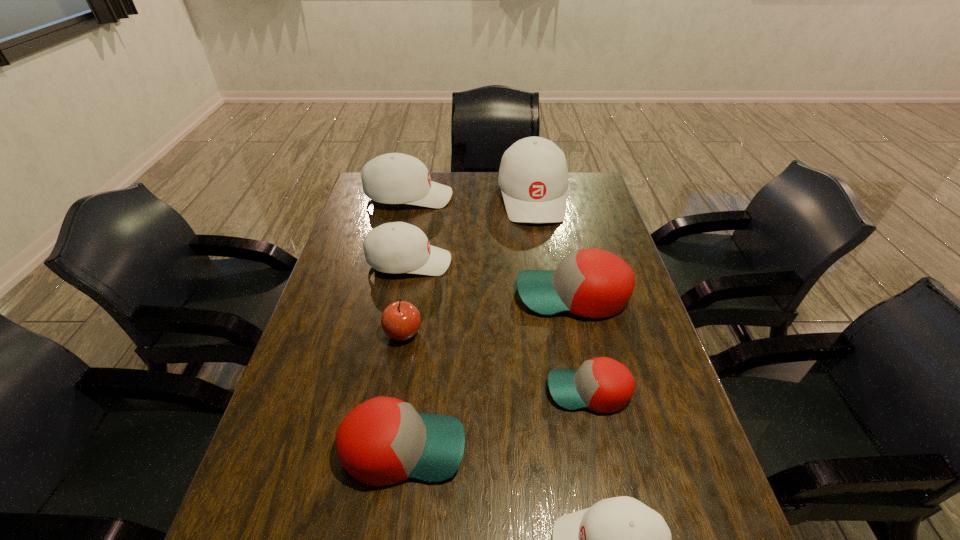
You are a GUI agent. You are given a task and a screenshot of the screen. Output one action in this format:
    pyautogui.click(x=<x>, y=<y>)
    Task: Click on the vacant area that satisfies the following two spatial constraints: 1. on the back side of the apple; 2. on the front-facing side of the second nearest white baseball cap
    The width and height of the screenshot is (960, 540).
    Given the screenshot: What is the action you would take?
    pyautogui.click(x=415, y=262)

Locate an element on the screen. free space that satisfies the following two spatial constraints: 1. on the front-facing side of the biggest white baseball cap; 2. at the brim of the second biggest red baseball cap is located at coordinates (574, 448).

Where is `free space that satisfies the following two spatial constraints: 1. on the front-facing side of the second smallest white baseball cap; 2. on the left side of the apple`? This screenshot has width=960, height=540. free space that satisfies the following two spatial constraints: 1. on the front-facing side of the second smallest white baseball cap; 2. on the left side of the apple is located at coordinates (396, 333).

Identify the location of blank space that satisfies the following two spatial constraints: 1. on the front-facing side of the tallest baseball cap; 2. on the front-facing side of the second smallest white baseball cap. The height and width of the screenshot is (540, 960). (543, 262).